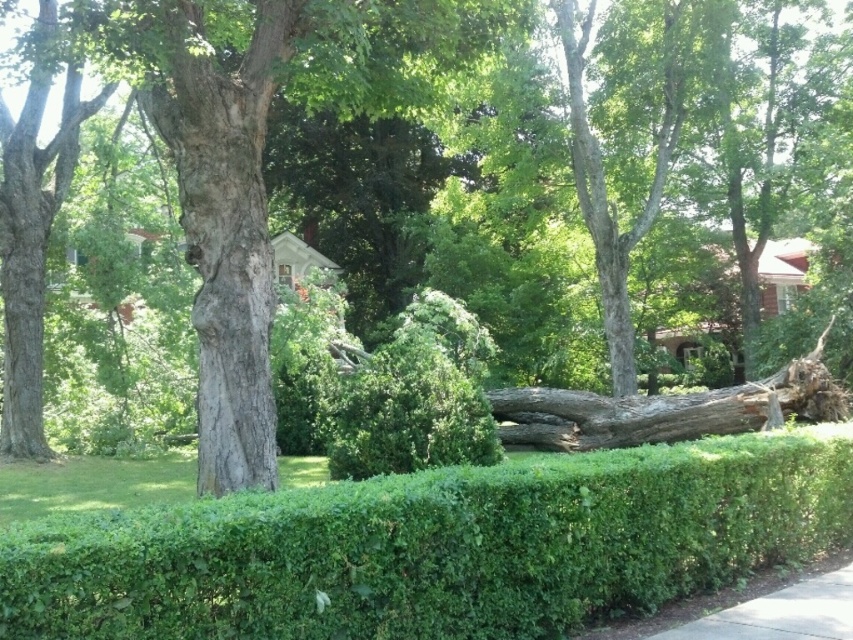
Can you confirm if green leafy hedge at center is positioned below gray concrete sidewalk at lower right?

Incorrect, green leafy hedge at center is not positioned below gray concrete sidewalk at lower right.

Which is in front, point (770, 474) or point (805, 628)?

Positioned in front is point (805, 628).

Where is `green leafy hedge at center`? green leafy hedge at center is located at coordinates (437, 547).